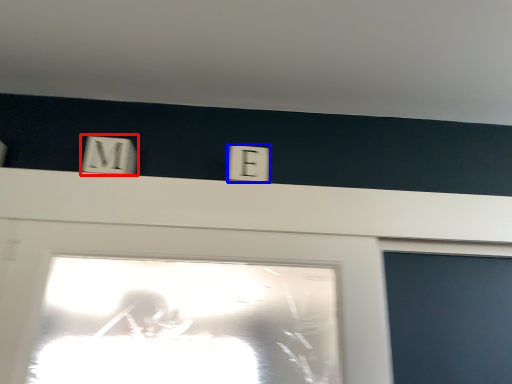
Question: Among these objects, which one is farthest to the camera, light switch (highlighted by a red box) or electric outlet (highlighted by a blue box)?

Choices:
 (A) light switch
 (B) electric outlet

Answer: (B)